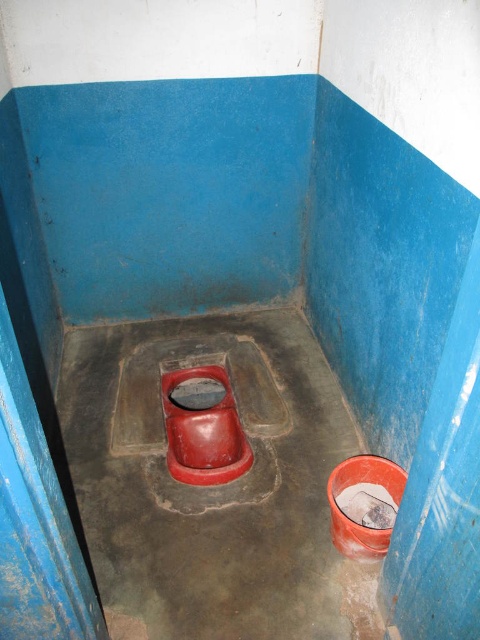
Between point (303, 403) and point (218, 419), which one is positioned behind?

The point (303, 403) is more distant.

Is smooth plastic toilet at center behind matte plastic toilet bowl at center?

No, it is not.

Who is more forward, (215, 541) or (205, 422)?

Positioned in front is point (215, 541).

Locate an element on the screen. The height and width of the screenshot is (640, 480). smooth plastic toilet at center is located at coordinates (214, 486).